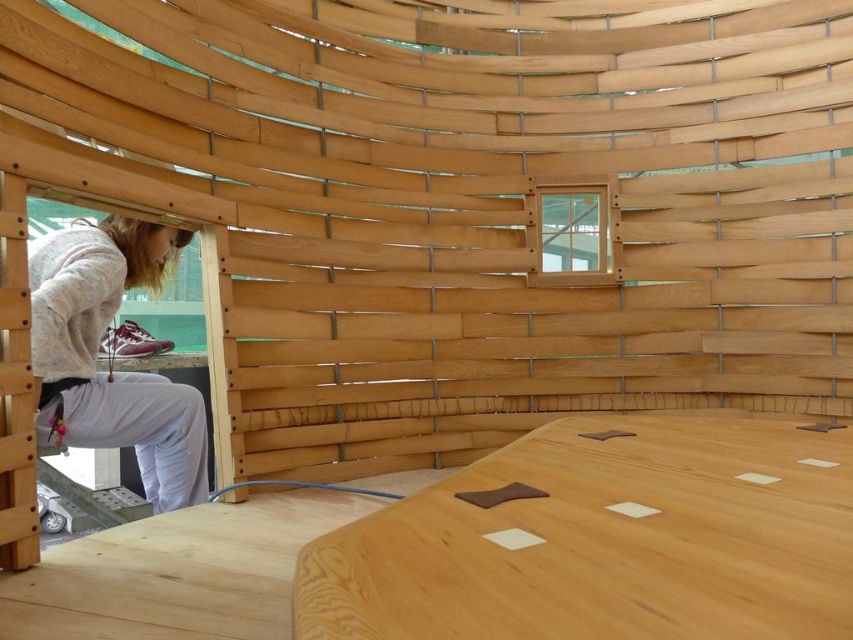
Does natural wood table at center have a lesser height compared to light gray sweater at lower left?

Yes.

Is natural wood table at center in front of light gray sweater at lower left?

That is True.

I want to click on natural wood table at center, so click(604, 540).

Locate an element on the screen. This screenshot has height=640, width=853. natural wood table at center is located at coordinates pyautogui.click(x=604, y=540).